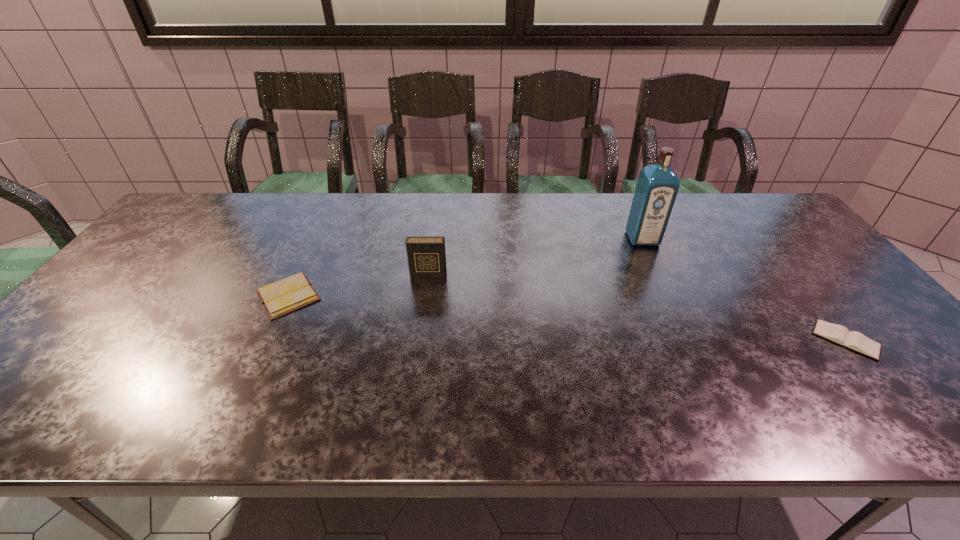
Locate an element on the screen. The height and width of the screenshot is (540, 960). object at the far edge is located at coordinates [x=657, y=186].

Where is `object at the right edge`? This screenshot has width=960, height=540. object at the right edge is located at coordinates (856, 341).

The width and height of the screenshot is (960, 540). I want to click on blank space at the far edge of the desktop, so click(x=513, y=197).

Find the location of a particular element. This screenshot has height=540, width=960. free space at the near edge of the desktop is located at coordinates (557, 426).

Where is `blank space at the left edge`? blank space at the left edge is located at coordinates (x=83, y=315).

This screenshot has height=540, width=960. In order to click on vacant region at the right edge of the desktop in this screenshot , I will do `click(900, 363)`.

Locate an element on the screen. This screenshot has width=960, height=540. vacant space at the far left corner of the desktop is located at coordinates (240, 198).

Where is `free spot at the far right corner of the desktop`? The height and width of the screenshot is (540, 960). free spot at the far right corner of the desktop is located at coordinates (732, 194).

I want to click on vacant space in between the second object from left to right and the leftmost diary, so click(x=358, y=287).

The height and width of the screenshot is (540, 960). I want to click on free space between the leftmost diary and the tallest diary, so click(358, 287).